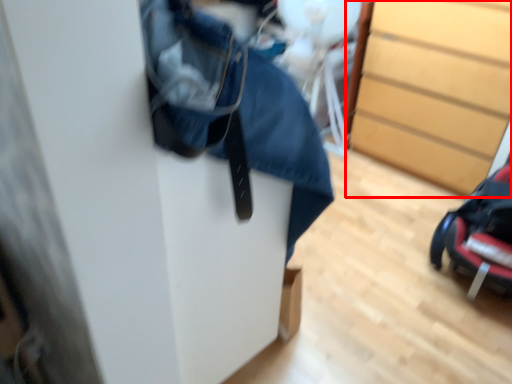
Question: From the image's perspective, where is chest of drawers (annotated by the red box) located relative to baby carriage?

Choices:
 (A) below
 (B) above

Answer: (B)